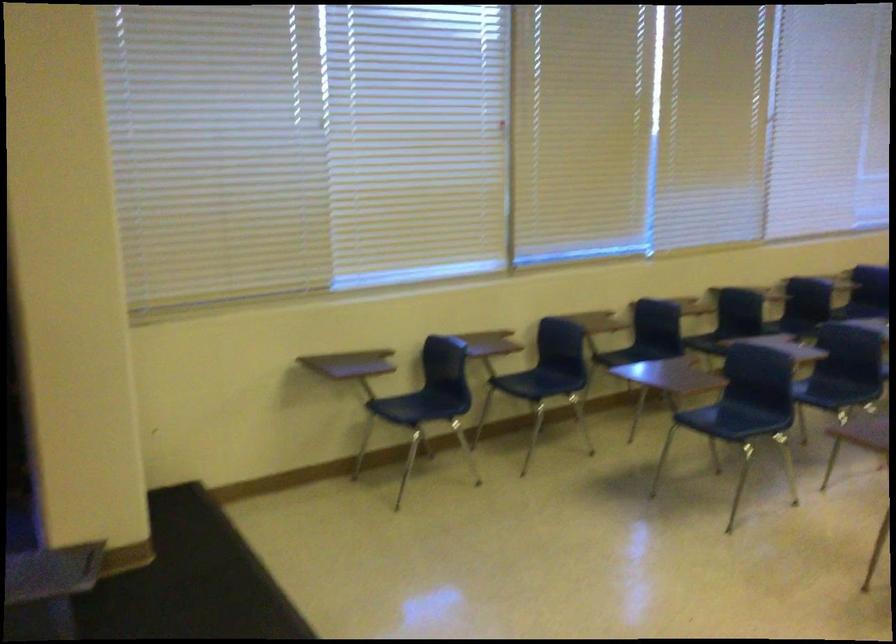
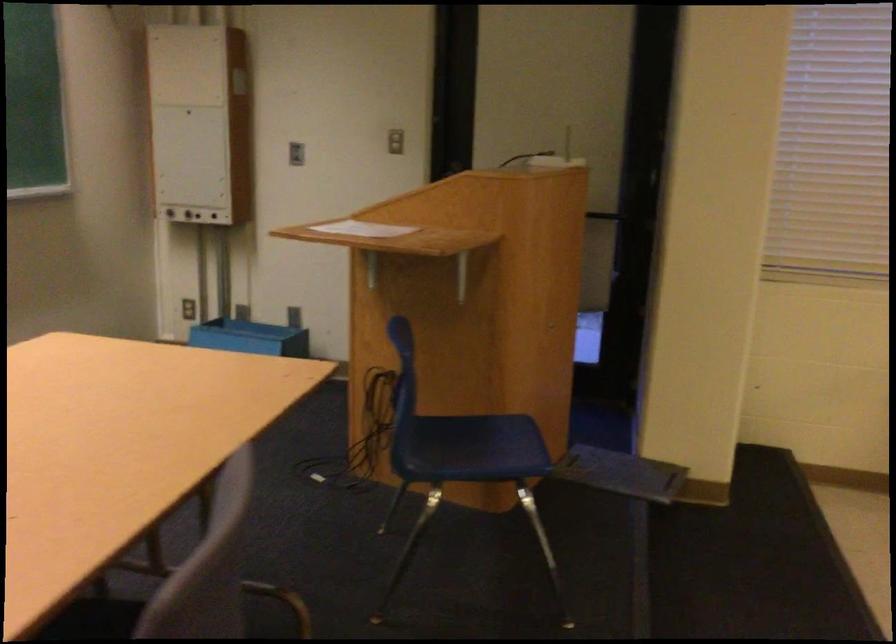
Question: How did the camera likely rotate?

Choices:
 (A) Left
 (B) Right
 (C) Up
 (D) Down

Answer: (A)